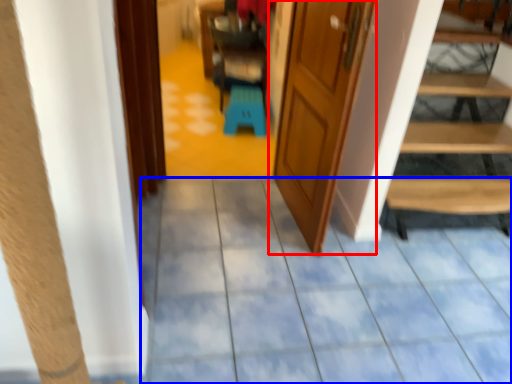
Question: Which object appears closest to the camera in this image, door (highlighted by a red box) or path (highlighted by a blue box)?

Choices:
 (A) door
 (B) path

Answer: (B)